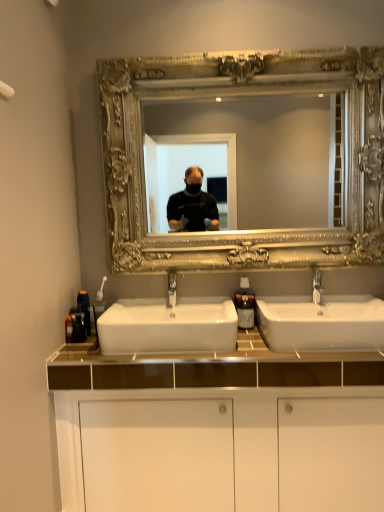
Find the location of a particular element. The image size is (384, 512). free point in front of silver metallic faucet at center is located at coordinates (334, 314).